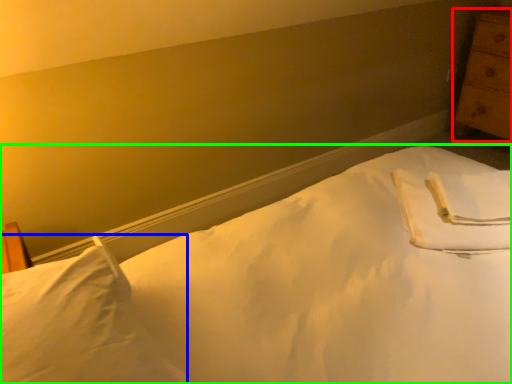
Question: Considering the real-world distances, which object is closest to chest of drawers (highlighted by a red box)? pillow (highlighted by a blue box) or bed (highlighted by a green box).

Choices:
 (A) pillow
 (B) bed

Answer: (B)